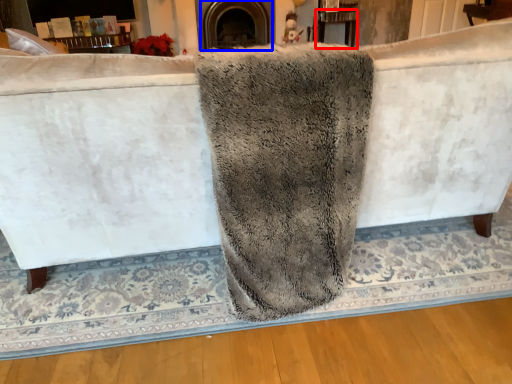
Question: Which object is further to the camera taking this photo, table (highlighted by a red box) or fireplace (highlighted by a blue box)?

Choices:
 (A) table
 (B) fireplace

Answer: (A)